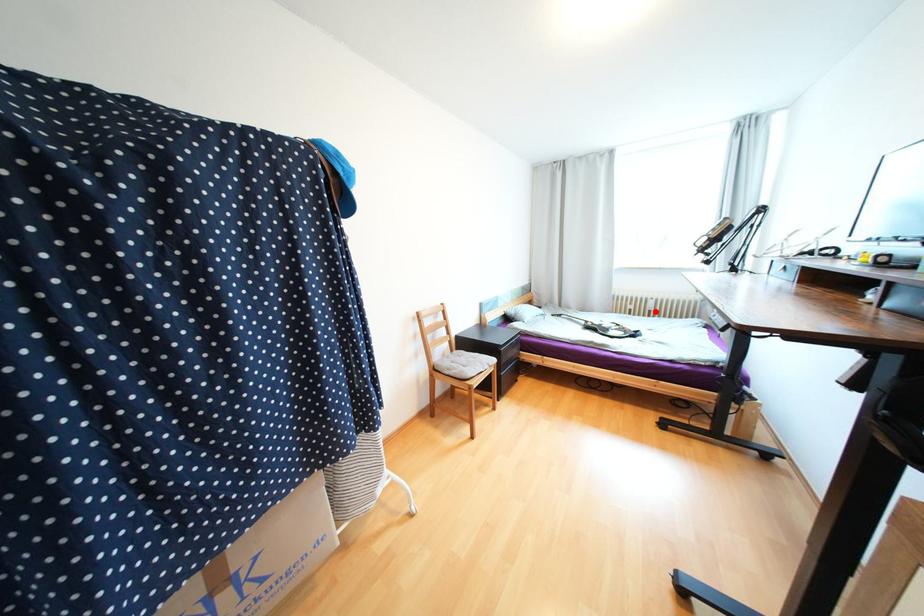
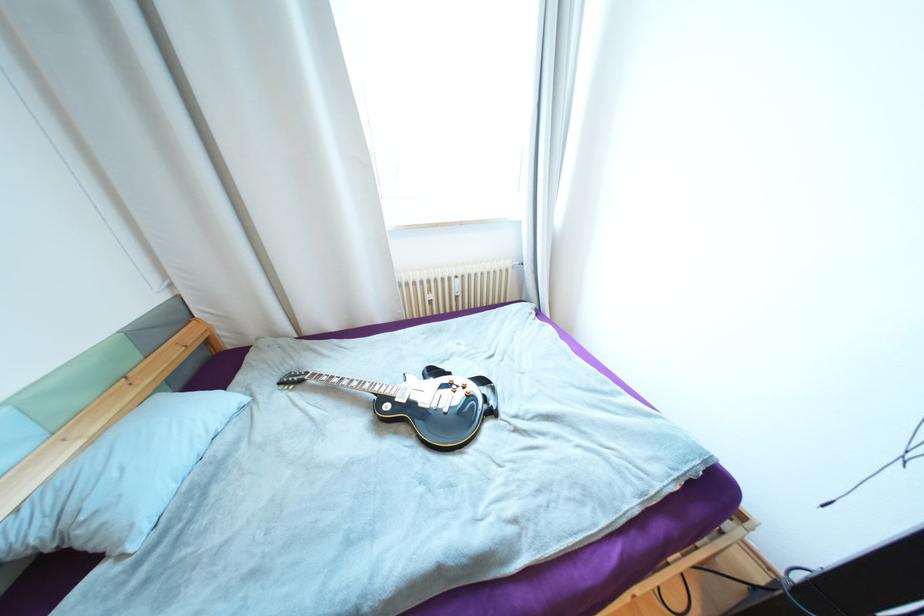
Find the pixel in the second image that matches the highlighted location in the first image.

(463, 297)